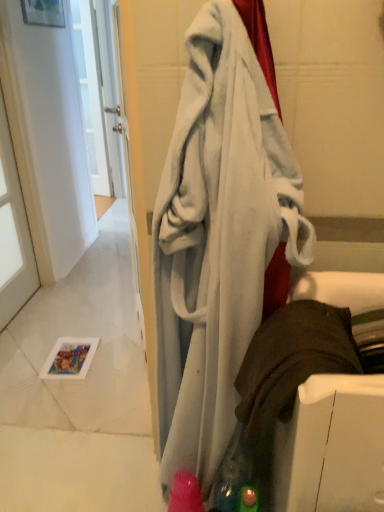
Question: In the image, is soft white towel at center on the left side or the right side of transparent glass door at left?

Choices:
 (A) right
 (B) left

Answer: (A)

Question: From the image's perspective, is soft white towel at center located above or below transparent glass door at left?

Choices:
 (A) below
 (B) above

Answer: (A)

Question: Which is correct: soft white towel at center is inside transparent glass door at left, or outside of it?

Choices:
 (A) outside
 (B) inside

Answer: (A)

Question: Looking at the image, does transparent glass door at left seem bigger or smaller compared to soft white towel at center?

Choices:
 (A) big
 (B) small

Answer: (B)

Question: Considering their positions, is transparent glass door at left located in front of or behind soft white towel at center?

Choices:
 (A) behind
 (B) front

Answer: (A)

Question: From a real-world perspective, is transparent glass door at left physically located above or below soft white towel at center?

Choices:
 (A) below
 (B) above

Answer: (A)

Question: From the image's perspective, is transparent glass door at left positioned above or below soft white towel at center?

Choices:
 (A) below
 (B) above

Answer: (B)